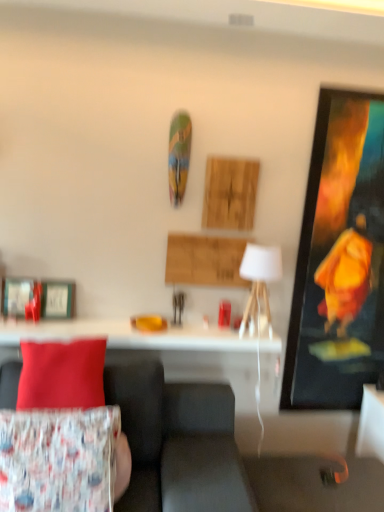
Question: Can you see velvet fabric couch at lower left touching metallic silver picture frame at left?

Choices:
 (A) yes
 (B) no

Answer: (B)

Question: Is there a large distance between velvet fabric couch at lower left and metallic silver picture frame at left?

Choices:
 (A) yes
 (B) no

Answer: (B)

Question: Is velvet fabric couch at lower left not inside metallic silver picture frame at left?

Choices:
 (A) yes
 (B) no

Answer: (A)

Question: Is velvet fabric couch at lower left positioned before metallic silver picture frame at left?

Choices:
 (A) no
 (B) yes

Answer: (B)

Question: Does velvet fabric couch at lower left appear on the right side of metallic silver picture frame at left?

Choices:
 (A) yes
 (B) no

Answer: (A)

Question: Based on their positions, is floral fabric cushion at lower left, the first pillow when ordered from bottom to top, located to the left or right of matte red pillow at left, which is counted as the 1th pillow, starting from the top?

Choices:
 (A) right
 (B) left

Answer: (A)

Question: Is floral fabric cushion at lower left, the 2th pillow positioned from the top, situated inside matte red pillow at left, acting as the 2th pillow starting from the bottom, or outside?

Choices:
 (A) inside
 (B) outside

Answer: (B)

Question: Considering the positions of floral fabric cushion at lower left, the 2th pillow positioned from the top, and matte red pillow at left, which is counted as the 1th pillow, starting from the top, in the image, is floral fabric cushion at lower left, the 2th pillow positioned from the top, taller or shorter than matte red pillow at left, which is counted as the 1th pillow, starting from the top,?

Choices:
 (A) short
 (B) tall

Answer: (B)

Question: From a real-world perspective, relative to matte red pillow at left, acting as the 2th pillow starting from the bottom, is floral fabric cushion at lower left, the first pillow when ordered from bottom to top, vertically above or below?

Choices:
 (A) above
 (B) below

Answer: (B)

Question: Is white glossy table at center taller or shorter than printed fabric cushion at lower left?

Choices:
 (A) short
 (B) tall

Answer: (A)

Question: Is point (3, 342) closer or farther from the camera than point (21, 353)?

Choices:
 (A) farther
 (B) closer

Answer: (A)

Question: Visually, is white glossy table at center positioned to the left or to the right of printed fabric cushion at lower left?

Choices:
 (A) left
 (B) right

Answer: (B)

Question: From the image's perspective, is white glossy table at center located above or below printed fabric cushion at lower left?

Choices:
 (A) above
 (B) below

Answer: (A)

Question: Choose the correct answer: Is matte red pillow at left, acting as the 2th pillow starting from the bottom, inside floral fabric cushion at lower left, the first pillow when ordered from bottom to top, or outside it?

Choices:
 (A) inside
 (B) outside

Answer: (B)

Question: Considering the positions of matte red pillow at left, which is counted as the 1th pillow, starting from the top, and floral fabric cushion at lower left, the 2th pillow positioned from the top, in the image, is matte red pillow at left, which is counted as the 1th pillow, starting from the top, bigger or smaller than floral fabric cushion at lower left, the 2th pillow positioned from the top,?

Choices:
 (A) small
 (B) big

Answer: (A)